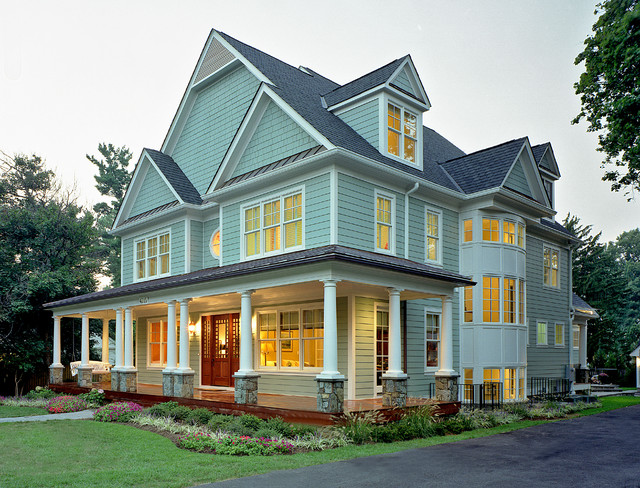
Identify the location of front door. The image size is (640, 488). (220, 370).